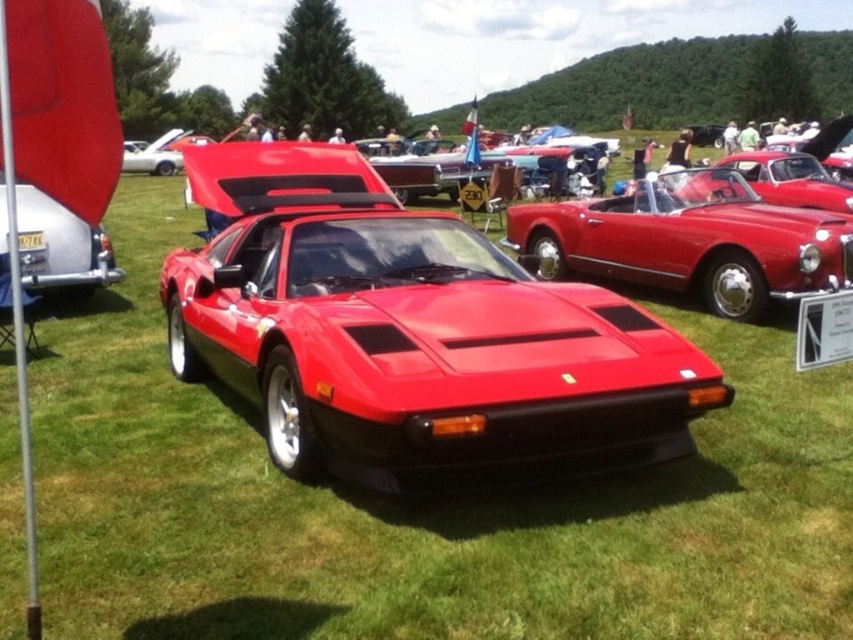
Who is positioned more to the right, shiny red sports car at center or glossy red convertible at center?

Positioned to the right is glossy red convertible at center.

Is shiny red sports car at center wider than glossy red convertible at center?

Yes.

Locate an element on the screen. Image resolution: width=853 pixels, height=640 pixels. shiny red sports car at center is located at coordinates (410, 333).

From the picture: Between glossy red convertible at center and metallic silver license plate at left, which one is positioned higher?

glossy red convertible at center

Can you confirm if glossy red convertible at center is bigger than metallic silver license plate at left?

Correct, glossy red convertible at center is larger in size than metallic silver license plate at left.

Find the location of a particular element. The width and height of the screenshot is (853, 640). glossy red convertible at center is located at coordinates (689, 241).

Who is lower down, shiny red sports car at center or metallic silver license plate at left?

Positioned lower is shiny red sports car at center.

Measure the distance between point (277, 248) and camera.

Point (277, 248) and camera are 13.35 feet apart.

This screenshot has width=853, height=640. I want to click on shiny red sports car at center, so click(x=410, y=333).

Where is `shiny red sports car at center`? This screenshot has width=853, height=640. shiny red sports car at center is located at coordinates (410, 333).